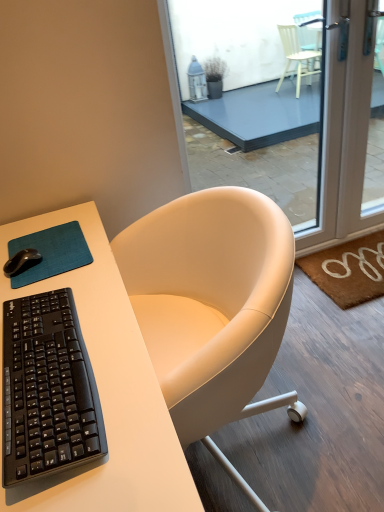
Question: From a real-world perspective, is black matte mouse at upper left physically below brown coir doormat at lower right?

Choices:
 (A) no
 (B) yes

Answer: (A)

Question: Is black matte mouse at upper left touching brown coir doormat at lower right?

Choices:
 (A) yes
 (B) no

Answer: (B)

Question: Is black matte mouse at upper left completely or partially outside of brown coir doormat at lower right?

Choices:
 (A) yes
 (B) no

Answer: (A)

Question: Is black matte mouse at upper left smaller than brown coir doormat at lower right?

Choices:
 (A) yes
 (B) no

Answer: (A)

Question: From the image's perspective, is black matte mouse at upper left on top of brown coir doormat at lower right?

Choices:
 (A) yes
 (B) no

Answer: (A)

Question: From the image's perspective, is teal fabric mousepad at lower left positioned above or below brown coir doormat at lower right?

Choices:
 (A) above
 (B) below

Answer: (A)

Question: Is teal fabric mousepad at lower left to the left or to the right of brown coir doormat at lower right in the image?

Choices:
 (A) left
 (B) right

Answer: (A)

Question: Is teal fabric mousepad at lower left in front of or behind brown coir doormat at lower right in the image?

Choices:
 (A) front
 (B) behind

Answer: (A)

Question: Is point (43, 237) positioned closer to the camera than point (367, 236)?

Choices:
 (A) closer
 (B) farther

Answer: (A)

Question: Is point (261, 34) closer or farther from the camera than point (87, 382)?

Choices:
 (A) farther
 (B) closer

Answer: (A)

Question: From the image's perspective, relative to black plastic keyboard at left, is transparent glass door at center above or below?

Choices:
 (A) below
 (B) above

Answer: (B)

Question: Is transparent glass door at center spatially inside black plastic keyboard at left, or outside of it?

Choices:
 (A) outside
 (B) inside

Answer: (A)

Question: Looking at the image, does transparent glass door at center seem bigger or smaller compared to black plastic keyboard at left?

Choices:
 (A) big
 (B) small

Answer: (A)

Question: From the image's perspective, relative to brown coir doormat at lower right, is white matte desk at center above or below?

Choices:
 (A) below
 (B) above

Answer: (A)

Question: Is white matte desk at center spatially inside brown coir doormat at lower right, or outside of it?

Choices:
 (A) inside
 (B) outside

Answer: (B)